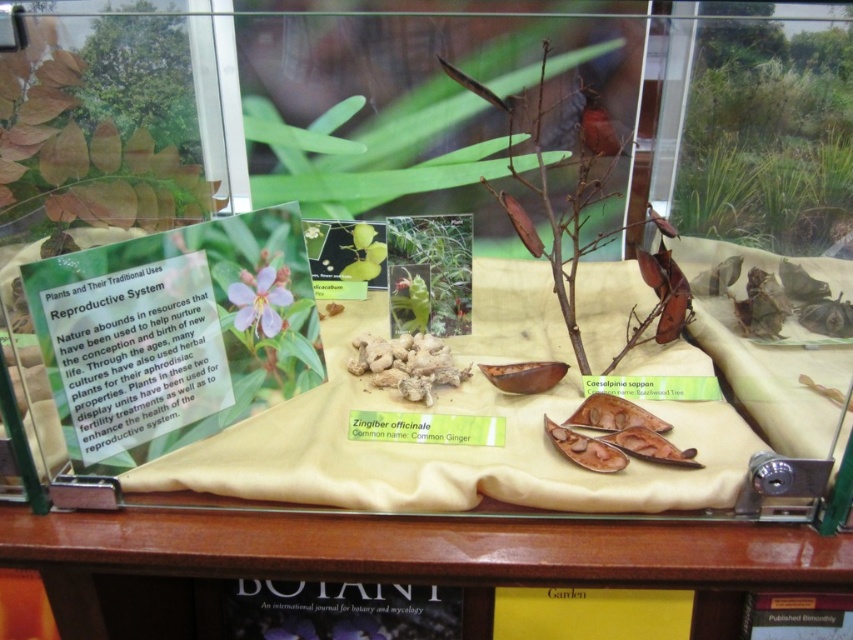
Question: Is beige fabric at center to the left of purple matte flower at upper center from the viewer's perspective?

Choices:
 (A) yes
 (B) no

Answer: (B)

Question: Is beige fabric at center bigger than purple matte flower at upper center?

Choices:
 (A) yes
 (B) no

Answer: (A)

Question: Which point is farther from the camera taking this photo?

Choices:
 (A) (405, 401)
 (B) (265, 330)

Answer: (A)

Question: Is beige fabric at center wider than purple matte flower at upper center?

Choices:
 (A) no
 (B) yes

Answer: (B)